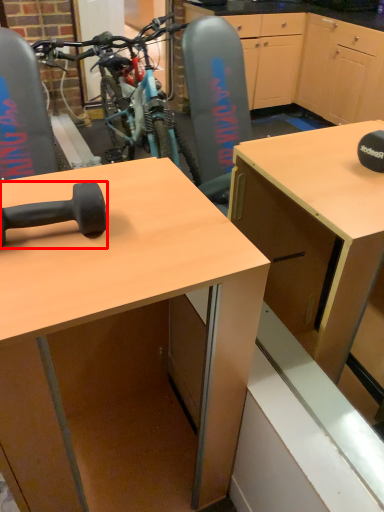
Question: From the image's perspective, what is the correct spatial relationship of dumbbell (annotated by the red box) in relation to desk?

Choices:
 (A) below
 (B) above

Answer: (B)